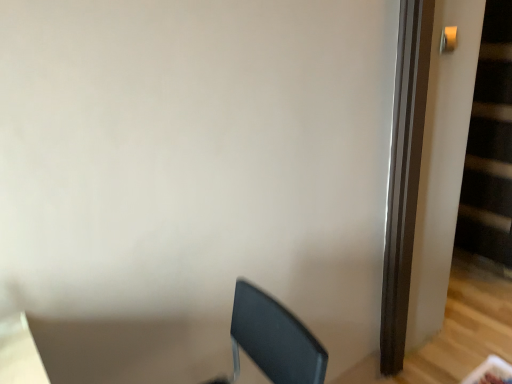
Where is `dark brown wooden stairs at right`? The image size is (512, 384). dark brown wooden stairs at right is located at coordinates (490, 146).

What do you see at coordinates (490, 146) in the screenshot? This screenshot has width=512, height=384. I see `dark brown wooden stairs at right` at bounding box center [490, 146].

At what (x,y) coordinates should I click in order to perform the action: click on dark brown wooden stairs at right. Please return your answer as a coordinate pair (x, y). Looking at the image, I should click on (490, 146).